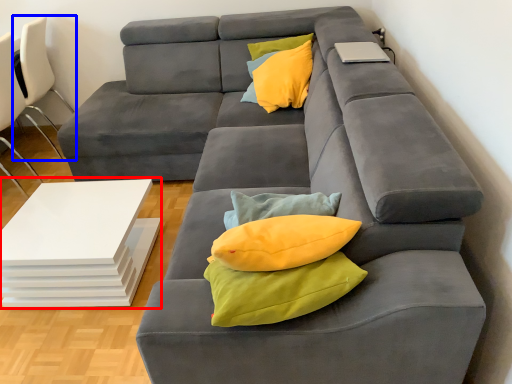
Question: Which object appears farthest to the camera in this image, table (highlighted by a red box) or chair (highlighted by a blue box)?

Choices:
 (A) table
 (B) chair

Answer: (B)